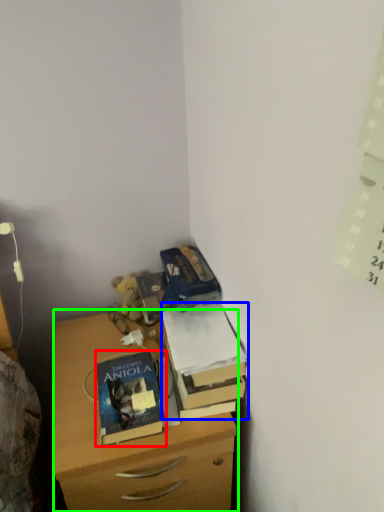
Question: Which is nearer to the book (highlighted by a red box)? box (highlighted by a blue box) or chest of drawers (highlighted by a green box).

Choices:
 (A) box
 (B) chest of drawers

Answer: (B)